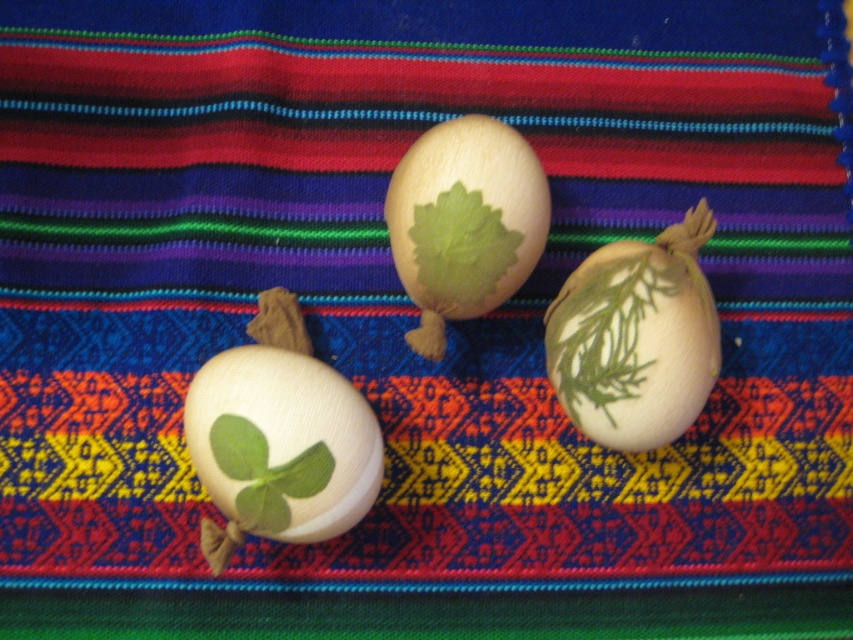
Question: Which object is positioned closest to the wooden egg with leaf design at center?

Choices:
 (A) wooden egg with green leaf at center
 (B) green matte onion at center

Answer: (B)

Question: Is wooden egg with green leaf at center smaller than green matte onion at center?

Choices:
 (A) no
 (B) yes

Answer: (A)

Question: Can you confirm if wooden egg with green leaf at center is bigger than wooden egg with leaf design at center?

Choices:
 (A) no
 (B) yes

Answer: (B)

Question: Estimate the real-world distances between objects in this image. Which object is closer to the wooden egg with green leaf at center?

Choices:
 (A) green matte onion at center
 (B) wooden egg with leaf design at center

Answer: (B)

Question: Which object is farther from the camera taking this photo?

Choices:
 (A) wooden egg with leaf design at center
 (B) wooden egg with green leaf at center
 (C) green matte onion at center

Answer: (A)

Question: Observing the image, what is the correct spatial positioning of green matte onion at center in reference to wooden egg with leaf design at center?

Choices:
 (A) right
 (B) left

Answer: (A)